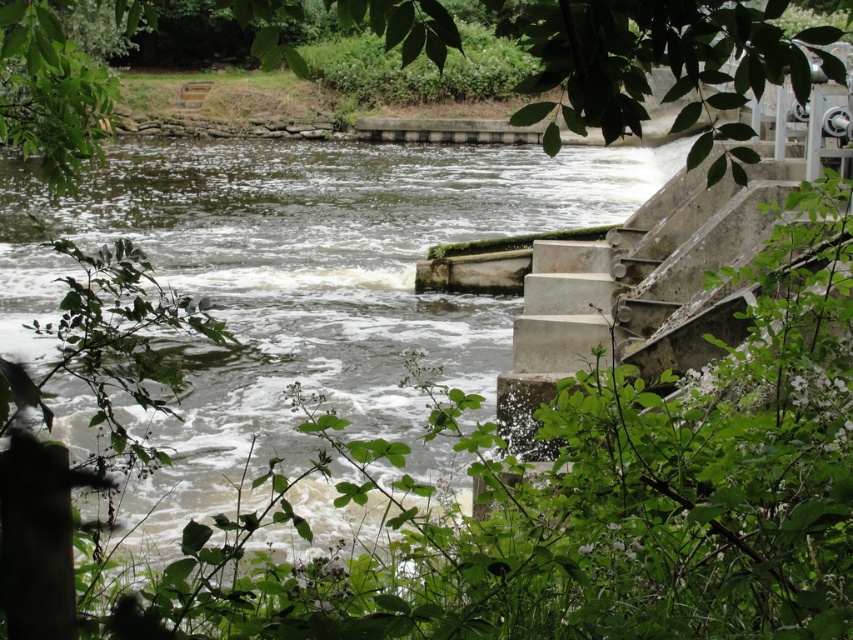
Which of these two, dark green concrete river at center or green leafy tree at upper center, stands taller?

Standing taller between the two is green leafy tree at upper center.

Is dark green concrete river at center thinner than green leafy tree at upper center?

Incorrect, dark green concrete river at center's width is not less than green leafy tree at upper center's.

Between point (119, 225) and point (527, 4), which one is positioned behind?

Point (119, 225)

Identify the location of dark green concrete river at center. The image size is (853, 640). coord(300,285).

Is point (743, 230) in front of point (0, 52)?

No, (743, 230) is further to viewer.

Is concrete stairs at right taller than green leafy tree at upper left?

No, concrete stairs at right is not taller than green leafy tree at upper left.

What do you see at coordinates (637, 291) in the screenshot? This screenshot has height=640, width=853. I see `concrete stairs at right` at bounding box center [637, 291].

Identify the location of concrete stairs at right. (637, 291).

Is point (674, 96) in front of point (82, 120)?

Yes, it is.

Which is below, green leafy tree at upper center or green leafy tree at upper left?

green leafy tree at upper left

Is point (556, 1) farther from camera compared to point (0, 116)?

That is False.

This screenshot has width=853, height=640. Identify the location of green leafy tree at upper center. (659, 56).